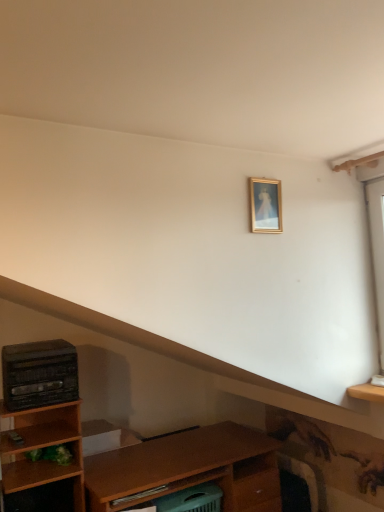
Question: Is black plastic stereo at left spatially inside gold-framed picture at upper center, or outside of it?

Choices:
 (A) outside
 (B) inside

Answer: (A)

Question: Considering the relative positions of black plastic stereo at left and gold-framed picture at upper center in the image provided, is black plastic stereo at left to the left or to the right of gold-framed picture at upper center?

Choices:
 (A) right
 (B) left

Answer: (B)

Question: Is black plastic stereo at left bigger or smaller than gold-framed picture at upper center?

Choices:
 (A) big
 (B) small

Answer: (A)

Question: From a real-world perspective, is gold-framed picture at upper center above or below black plastic stereo at left?

Choices:
 (A) above
 (B) below

Answer: (A)

Question: In terms of width, does gold-framed picture at upper center look wider or thinner when compared to black plastic stereo at left?

Choices:
 (A) thin
 (B) wide

Answer: (A)

Question: Considering the positions of point (281, 223) and point (46, 400), is point (281, 223) closer or farther from the camera than point (46, 400)?

Choices:
 (A) closer
 (B) farther

Answer: (A)

Question: Is gold-framed picture at upper center in front of or behind black plastic stereo at left in the image?

Choices:
 (A) front
 (B) behind

Answer: (A)